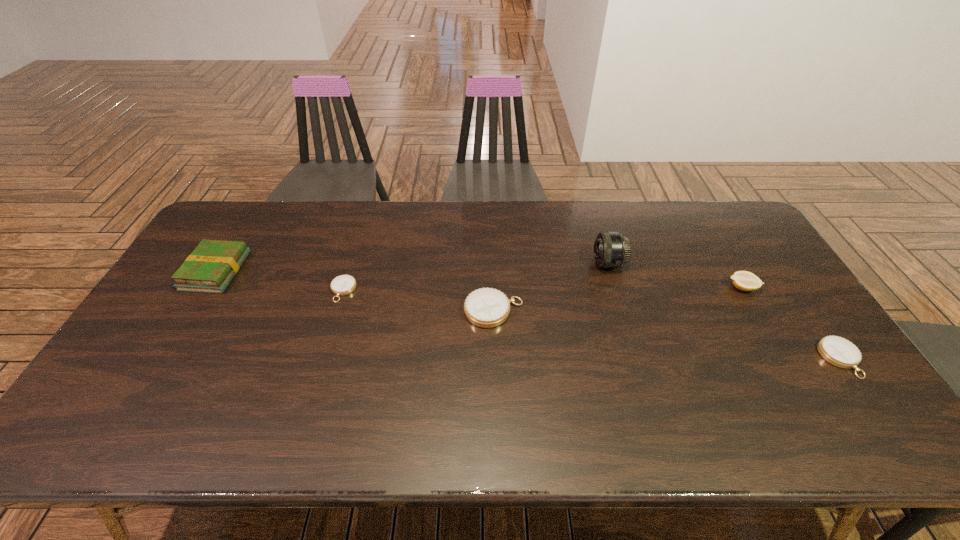
What are the coordinates of `the third object from right to left` in the screenshot? It's located at (611, 249).

Find the location of `telephoto lens`. telephoto lens is located at coordinates (611, 249).

The height and width of the screenshot is (540, 960). In order to click on free space located on the back of the leftmost compass in this screenshot , I will do `click(358, 240)`.

Find the location of a particular element. The height and width of the screenshot is (540, 960). free space located 0.160m on the front of the tallest compass is located at coordinates pyautogui.click(x=495, y=380).

Locate an element on the screen. The height and width of the screenshot is (540, 960). vacant space located on the left of the second tallest compass is located at coordinates (699, 359).

At what (x,y) coordinates should I click in order to perform the action: click on blank space located on the right of the book. Please return your answer as a coordinate pair (x, y). This screenshot has height=540, width=960. Looking at the image, I should click on (264, 271).

This screenshot has width=960, height=540. Identify the location of free space located 0.350m on the back of the second object from right to left. (698, 211).

Where is `free spot located 0.230m on the front-facing side of the fourth object from left to right`? free spot located 0.230m on the front-facing side of the fourth object from left to right is located at coordinates (521, 263).

I want to click on free space located 0.220m on the front-facing side of the fourth object from left to right, so click(524, 263).

This screenshot has height=540, width=960. In order to click on vacant position located on the front-facing side of the fourth object from left to right in this screenshot , I will do `click(549, 263)`.